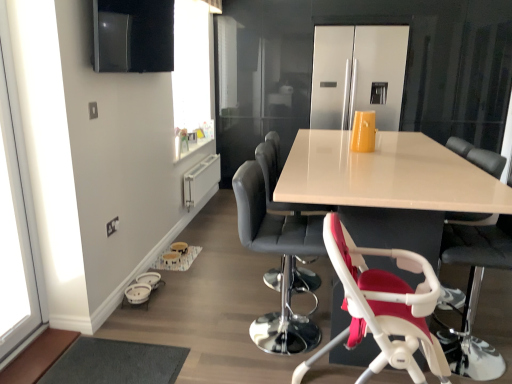
Identify the location of vacant space underneath transparent glass window at left (from a real-world perspective). (26, 352).